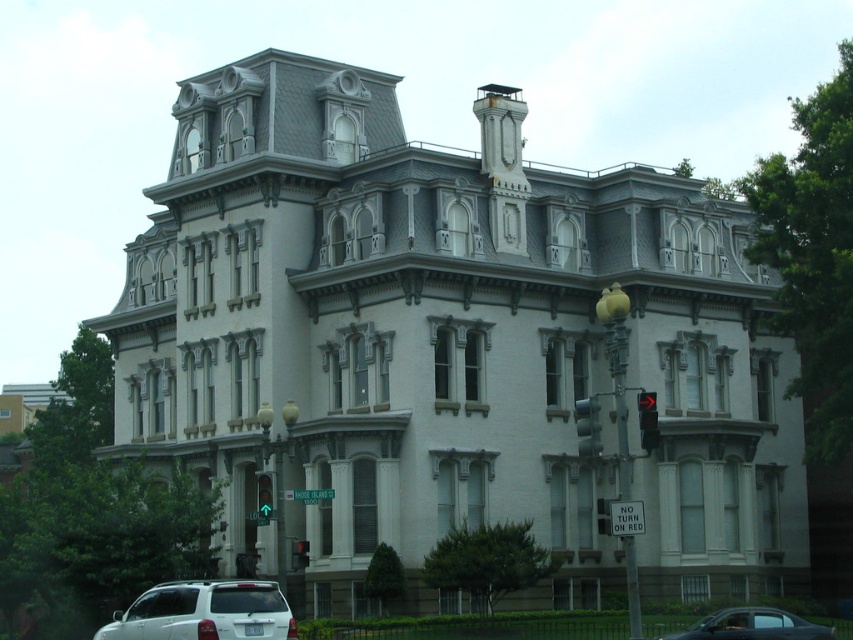
Does point (729, 637) come closer to viewer compared to point (292, 541)?

That is True.

Between metallic gray sedan at lower right and red glass traffic light at lower center, which one appears on the left side from the viewer's perspective?

From the viewer's perspective, red glass traffic light at lower center appears more on the left side.

Between point (779, 632) and point (299, 554), which one is positioned behind?

Point (299, 554)

I want to click on metallic gray sedan at lower right, so click(752, 625).

Who is taller, black glass traffic light at right or red glass traffic light at lower center?

Standing taller between the two is black glass traffic light at right.

Looking at this image, is black glass traffic light at right closer to camera compared to red glass traffic light at lower center?

Yes, it is.

What do you see at coordinates (647, 420) in the screenshot? The image size is (853, 640). I see `black glass traffic light at right` at bounding box center [647, 420].

Where is `black glass traffic light at right`? The image size is (853, 640). black glass traffic light at right is located at coordinates (647, 420).

Is point (260, 496) closer to camera compared to point (602, 524)?

Yes, point (260, 496) is closer to viewer.

From the picture: Is green glass traffic light at lower left positioned at the back of metallic traffic light at lower right?

Yes, green glass traffic light at lower left is further from the viewer.

Describe the element at coordinates (264, 497) in the screenshot. Image resolution: width=853 pixels, height=640 pixels. I see `green glass traffic light at lower left` at that location.

Where is `green glass traffic light at lower left`? The width and height of the screenshot is (853, 640). green glass traffic light at lower left is located at coordinates (264, 497).